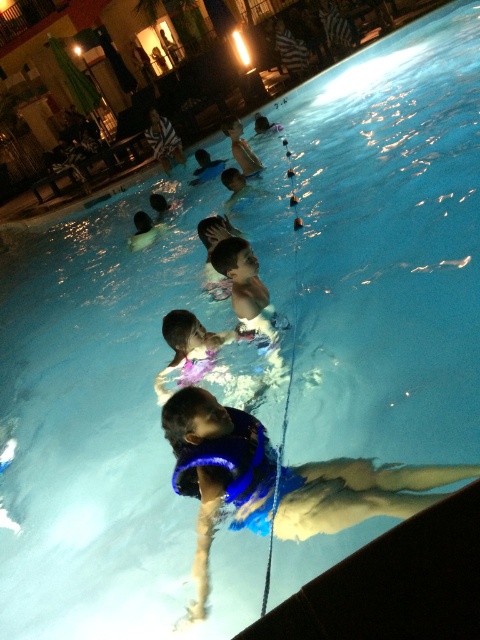
Based on the photo, you are a lifeguard who needs to retrieve the white plastic cup at upper center and the blue life vest at center. Based on their positions, which object should you reach for first if you are standing at the poolside facing the center of the pool?

The white plastic cup at upper center should be reached for first because the blue life vest at center is to the right of it, meaning the cup is closer to your current position at the poolside.

You are a lifeguard at the pool and need to place a white plastic cup at upper center on the edge of the blue life vest at center. Will the cup fit on the life vest without hanging over the edges?

The blue life vest at center is wider than the white plastic cup at upper center, so the cup will fit on the life vest without hanging over the edges.

You are a photographer standing at the edge of the pool. You want to take a photo that includes both the blue life vest at center and the white plastic cup at upper center. Which object should you focus on first to ensure both are in clear view?

You should focus on the blue life vest at center first because it is closer to the viewer than the white plastic cup at upper center. By focusing on the closer object, the farther one will still be in focus due to the depth of field.